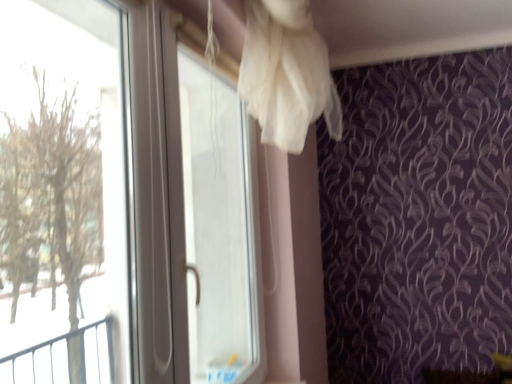
Question: Is the depth of transparent plastic screen door at upper center greater than that of transparent plastic window at left?

Choices:
 (A) no
 (B) yes

Answer: (B)

Question: Is transparent plastic screen door at upper center oriented away from transparent plastic window at left?

Choices:
 (A) no
 (B) yes

Answer: (A)

Question: Is transparent plastic screen door at upper center at the right side of transparent plastic window at left?

Choices:
 (A) no
 (B) yes

Answer: (B)

Question: Does transparent plastic screen door at upper center have a lesser height compared to transparent plastic window at left?

Choices:
 (A) yes
 (B) no

Answer: (B)

Question: Does transparent plastic screen door at upper center have a greater height compared to transparent plastic window at left?

Choices:
 (A) yes
 (B) no

Answer: (A)

Question: Is transparent plastic screen door at upper center next to transparent plastic window at left?

Choices:
 (A) no
 (B) yes

Answer: (A)

Question: Considering the relative positions of transparent plastic window at left and transparent plastic screen door at upper center in the image provided, is transparent plastic window at left to the left of transparent plastic screen door at upper center from the viewer's perspective?

Choices:
 (A) yes
 (B) no

Answer: (A)

Question: Considering the relative sizes of transparent plastic window at left and transparent plastic screen door at upper center in the image provided, is transparent plastic window at left wider than transparent plastic screen door at upper center?

Choices:
 (A) yes
 (B) no

Answer: (B)

Question: Is transparent plastic window at left thinner than transparent plastic screen door at upper center?

Choices:
 (A) yes
 (B) no

Answer: (A)

Question: From the image's perspective, is transparent plastic window at left located above transparent plastic screen door at upper center?

Choices:
 (A) yes
 (B) no

Answer: (A)

Question: Considering the relative sizes of transparent plastic window at left and transparent plastic screen door at upper center in the image provided, is transparent plastic window at left bigger than transparent plastic screen door at upper center?

Choices:
 (A) no
 (B) yes

Answer: (A)

Question: Is transparent plastic window at left positioned far away from transparent plastic screen door at upper center?

Choices:
 (A) yes
 (B) no

Answer: (A)

Question: In terms of height, does transparent plastic screen door at upper center look taller or shorter compared to transparent plastic window at left?

Choices:
 (A) tall
 (B) short

Answer: (A)